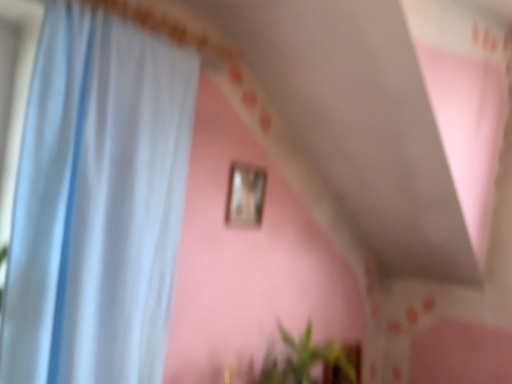
What do you see at coordinates (97, 202) in the screenshot?
I see `white sheer curtain at left` at bounding box center [97, 202].

The width and height of the screenshot is (512, 384). What do you see at coordinates (245, 196) in the screenshot?
I see `wooden picture frame at upper center` at bounding box center [245, 196].

I want to click on wooden picture frame at upper center, so click(245, 196).

Where is `white sheer curtain at left`? The width and height of the screenshot is (512, 384). white sheer curtain at left is located at coordinates (97, 202).

Is white sheer curtain at left at the back of green leafy plant at lower center?

No, green leafy plant at lower center's orientation is not away from white sheer curtain at left.

Would you say green leafy plant at lower center is a long distance from white sheer curtain at left?

That's not correct — green leafy plant at lower center is a little close to white sheer curtain at left.

From a real-world perspective, which object stands above the other?

white sheer curtain at left, from a real-world perspective.

Which is in front, green leafy plant at lower center or white sheer curtain at left?

Positioned in front is white sheer curtain at left.

Considering the sizes of objects white sheer curtain at left and wooden picture frame at upper center in the image provided, who is bigger, white sheer curtain at left or wooden picture frame at upper center?

Bigger between the two is white sheer curtain at left.

Which object is closer to the camera taking this photo, white sheer curtain at left or wooden picture frame at upper center?

white sheer curtain at left.

In terms of width, does white sheer curtain at left look wider or thinner when compared to wooden picture frame at upper center?

Clearly, white sheer curtain at left has more width compared to wooden picture frame at upper center.

From the image's perspective, is white sheer curtain at left on wooden picture frame at upper center?

No, from the image's perspective, white sheer curtain at left is not above wooden picture frame at upper center.

Identify the location of curtain in front of the green leafy plant at lower center. (97, 202).

From the image's perspective, relative to green leafy plant at lower center, is white sheer curtain at left above or below?

Based on their image positions, white sheer curtain at left is located above green leafy plant at lower center.

Does white sheer curtain at left have a larger size compared to green leafy plant at lower center?

Yes, white sheer curtain at left is bigger than green leafy plant at lower center.

Which is more to the right, white sheer curtain at left or green leafy plant at lower center?

Positioned to the right is green leafy plant at lower center.

Looking at this image, can you tell me how much green leafy plant at lower center and wooden picture frame at upper center differ in facing direction?

0.388 degrees.

Is green leafy plant at lower center completely or partially outside of wooden picture frame at upper center?

Yes, green leafy plant at lower center is located beyond the bounds of wooden picture frame at upper center.

Is green leafy plant at lower center wider than wooden picture frame at upper center?

Indeed, green leafy plant at lower center has a greater width compared to wooden picture frame at upper center.

From a real-world perspective, relative to wooden picture frame at upper center, is green leafy plant at lower center vertically above or below?

From a real-world perspective, green leafy plant at lower center is physically below wooden picture frame at upper center.

Is point (259, 208) positioned in front of point (306, 360)?

That is False.

Considering the sizes of wooden picture frame at upper center and green leafy plant at lower center in the image, is wooden picture frame at upper center taller or shorter than green leafy plant at lower center?

In the image, wooden picture frame at upper center appears to be shorter than green leafy plant at lower center.

What are the coordinates of `plant that appears on the right of wooden picture frame at upper center` in the screenshot? It's located at (305, 359).

Is wooden picture frame at upper center positioned far away from green leafy plant at lower center?

They are positioned close to each other.

Would you say wooden picture frame at upper center is to the left or to the right of white sheer curtain at left in the picture?

From the image, it's evident that wooden picture frame at upper center is to the right of white sheer curtain at left.

Based on the photo, can you tell me how much wooden picture frame at upper center and white sheer curtain at left differ in facing direction?

2.61 degrees separate the facing orientations of wooden picture frame at upper center and white sheer curtain at left.

Is wooden picture frame at upper center facing towards white sheer curtain at left?

No, wooden picture frame at upper center is not turned towards white sheer curtain at left.

Image resolution: width=512 pixels, height=384 pixels. Identify the location of plant that appears behind the white sheer curtain at left. (305, 359).

There is a white sheer curtain at left. Where is `picture frame above it (from a real-world perspective)`? The width and height of the screenshot is (512, 384). picture frame above it (from a real-world perspective) is located at coordinates (245, 196).

Which object lies nearer to the anchor point green leafy plant at lower center, wooden picture frame at upper center or white sheer curtain at left?

wooden picture frame at upper center is closer to green leafy plant at lower center.

Which object lies further to the anchor point white sheer curtain at left, wooden picture frame at upper center or green leafy plant at lower center?

green leafy plant at lower center.

Based on their spatial positions, is green leafy plant at lower center or white sheer curtain at left closer to wooden picture frame at upper center?

Among the two, green leafy plant at lower center is located nearer to wooden picture frame at upper center.

Looking at the image, which one is located further to green leafy plant at lower center, white sheer curtain at left or wooden picture frame at upper center?

Based on the image, white sheer curtain at left appears to be further to green leafy plant at lower center.

From the image, which object appears to be nearer to wooden picture frame at upper center, white sheer curtain at left or green leafy plant at lower center?

Based on the image, green leafy plant at lower center appears to be nearer to wooden picture frame at upper center.

Which object lies nearer to the anchor point white sheer curtain at left, green leafy plant at lower center or wooden picture frame at upper center?

wooden picture frame at upper center lies closer to white sheer curtain at left than the other object.

Identify the location of plant between white sheer curtain at left and wooden picture frame at upper center in the front-back direction. This screenshot has height=384, width=512. (305, 359).